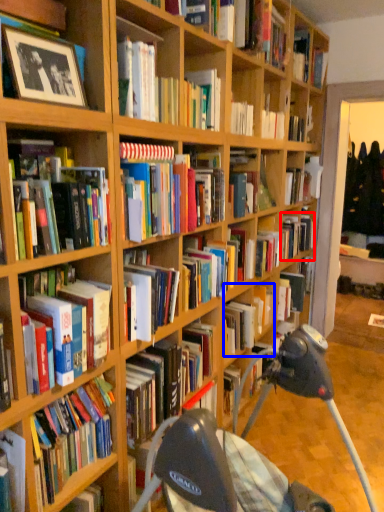
Question: Which point is further to the camera, book (highlighted by a red box) or book (highlighted by a blue box)?

Choices:
 (A) book
 (B) book

Answer: (A)